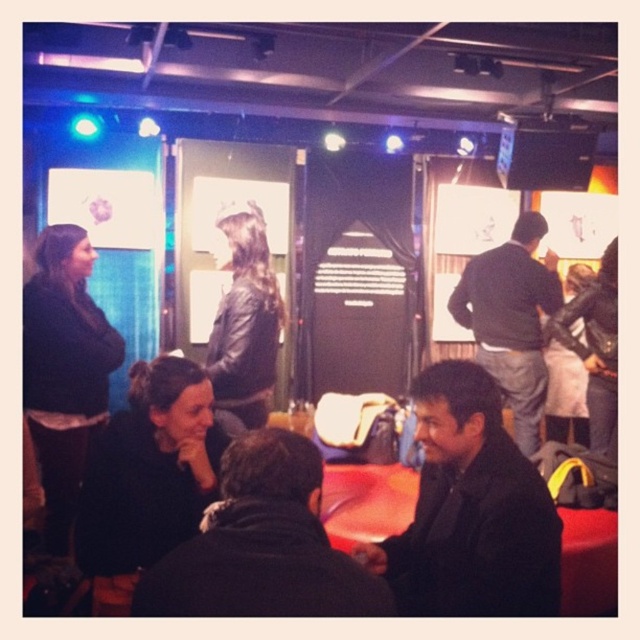
Between point (419, 573) and point (541, 230), which one is positioned in front?

Point (419, 573) is more forward.

What do you see at coordinates (470, 509) in the screenshot?
I see `black matte jacket at lower right` at bounding box center [470, 509].

This screenshot has height=640, width=640. In order to click on black matte jacket at lower right in this screenshot , I will do `click(470, 509)`.

Between point (234, 451) and point (520, 241), which one is positioned behind?

The point (520, 241) is more distant.

Who is higher up, dark brown leather jacket at lower center or dark gray sweater at center?

Positioned higher is dark gray sweater at center.

This screenshot has width=640, height=640. What are the coordinates of `dark brown leather jacket at lower center` in the screenshot? It's located at (262, 545).

What do you see at coordinates (470, 509) in the screenshot? Image resolution: width=640 pixels, height=640 pixels. I see `black matte jacket at lower right` at bounding box center [470, 509].

Who is more forward, (408, 525) or (346, 602)?

Point (346, 602)

Find the location of a particular element. black matte jacket at lower right is located at coordinates (470, 509).